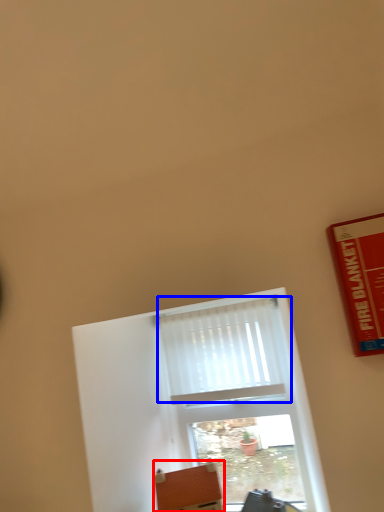
Question: Which object appears closest to the camera in this image, furniture (highlighted by a red box) or curtain (highlighted by a blue box)?

Choices:
 (A) furniture
 (B) curtain

Answer: (A)